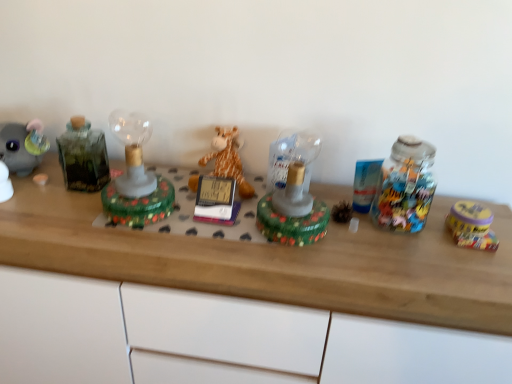
Where is `vacant space in front of green glass lamp at center, which appears as the fourth toy when viewed from the right`? This screenshot has width=512, height=384. vacant space in front of green glass lamp at center, which appears as the fourth toy when viewed from the right is located at coordinates (128, 242).